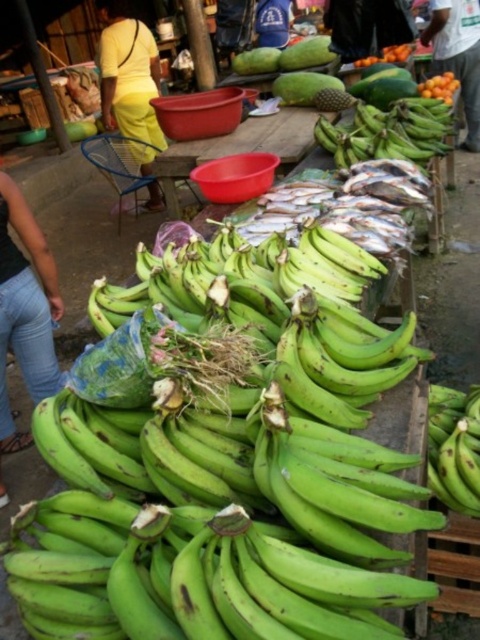
Question: From the image, what is the correct spatial relationship of orange matte/orange at upper right in relation to orange matte at upper center?

Choices:
 (A) above
 (B) below

Answer: (B)

Question: Which object appears farthest from the camera in this image?

Choices:
 (A) green smooth papaya at center
 (B) yellow fabric pants at upper left
 (C) shiny silver fish at center

Answer: (A)

Question: Is jeans at left closer to camera compared to orange matte/orange at upper right?

Choices:
 (A) no
 (B) yes

Answer: (B)

Question: Which object is closer to the camera taking this photo?

Choices:
 (A) green smooth papaya at center
 (B) shiny silver fish at center

Answer: (B)

Question: Which of the following is the farthest from the observer?

Choices:
 (A) white plastic bag at upper right
 (B) orange matte at upper center
 (C) green matte bananas at upper center

Answer: (A)

Question: Can you confirm if green matte bananas at upper center is smaller than white plastic bag at upper right?

Choices:
 (A) yes
 (B) no

Answer: (A)